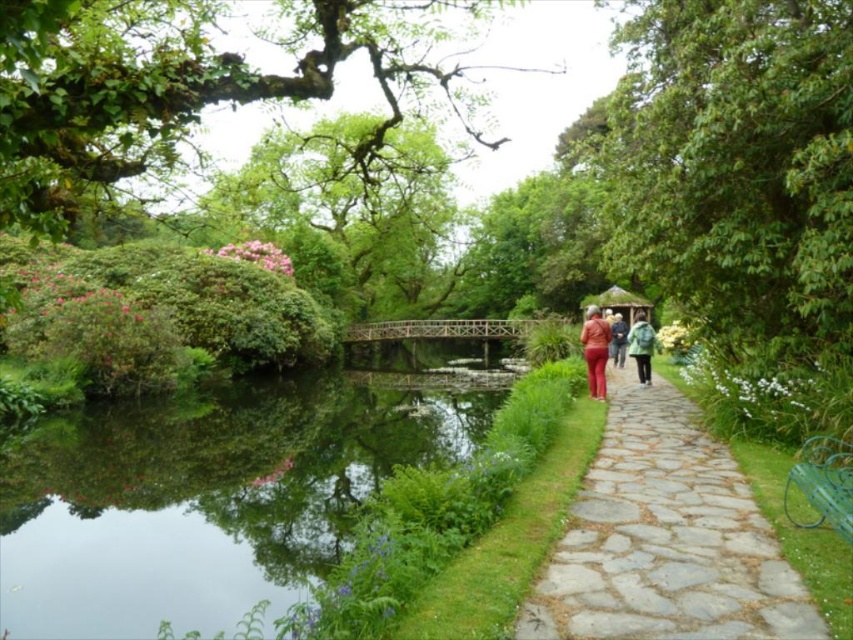
Is green mossy branch at upper left shorter than green matte jacket at center-right?

No, green mossy branch at upper left is not shorter than green matte jacket at center-right.

Who is higher up, green mossy branch at upper left or green matte jacket at center-right?

green mossy branch at upper left is higher up.

I want to click on green mossy branch at upper left, so click(x=177, y=88).

Does point (305, 502) come farther from viewer compared to point (602, 340)?

No, it is not.

Is point (99, 500) positioned after point (596, 387)?

No, it is not.

Find the location of `green reflective water at lower left`. green reflective water at lower left is located at coordinates (209, 496).

Is green leafy tree at right above matte red pants at center?

Yes, green leafy tree at right is above matte red pants at center.

Who is positioned more to the right, green leafy tree at right or matte red pants at center?

matte red pants at center is more to the right.

Is point (758, 211) less distant than point (595, 378)?

Yes, point (758, 211) is in front of point (595, 378).

Image resolution: width=853 pixels, height=640 pixels. Identify the location of green leafy tree at right. (737, 164).